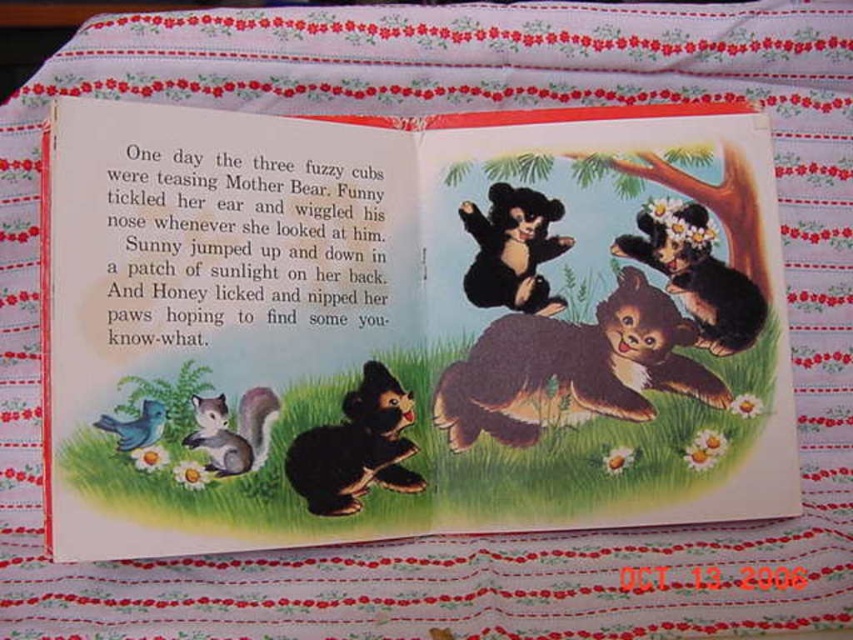
Looking at this image, you are looking at the children book page. The shiny black bear at upper right is located at point (409, 324). Where is the shiny black bear at upper right located?

The shiny black bear at upper right is located at point (409, 324).

You are an artist trying to recreate this childrens book page. You need to place the shiny black bear at upper right and the blue matte bird at lower left. Based on the original illustration, which object should be drawn first to ensure proper layering?

The shiny black bear at upper right should be drawn first because it is positioned over the blue matte bird at lower left, meaning it needs to be layered on top to appear above the bird.

You are looking at the children book page and want to find the brown furry bear at center. Can you tell me where exactly it is located in the image?

The brown furry bear at center is located at point (572,369).